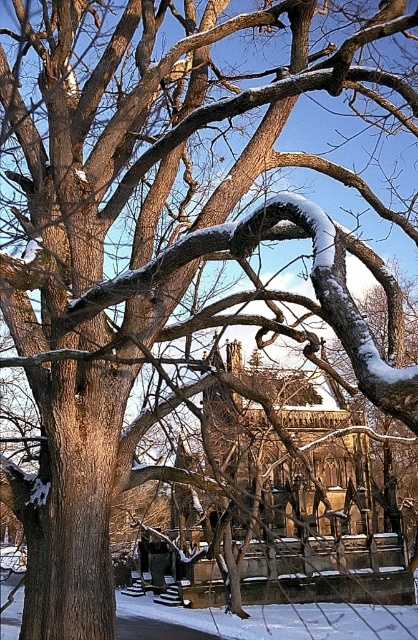
You are standing at the entrance of the historic stone building and want to sit on the wooden park bench at center. Which direction should you walk to reach it?

Since the wooden park bench at center is located at point coordinates, you need to walk towards the center area of the image to reach it.

You are a photographer setting up equipment in the winter scene. You need to place a tripod between the wooden park bench at center and the wooden park bench at lower center. Can you do this without placing the tripod on either bench?

The wooden park bench at center is positioned over the wooden park bench at lower center, so there is no space between them to place the tripod. The tripod would have to be placed on one of the benches.